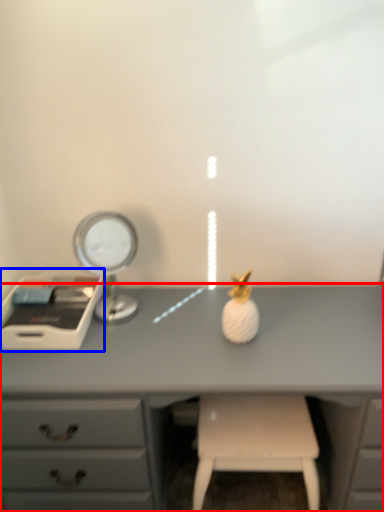
Question: Which of the following is the farthest to the observer, desk (highlighted by a red box) or writing desk (highlighted by a blue box)?

Choices:
 (A) desk
 (B) writing desk

Answer: (B)